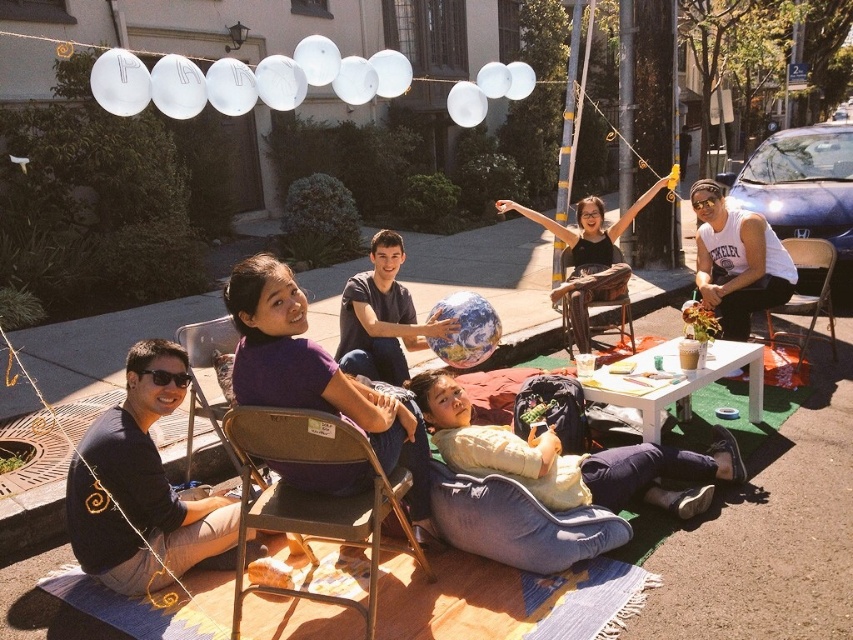
Is black matte shirt at lower left thinner than brown fabric chair at center?

No.

Which of these two, black matte shirt at lower left or brown fabric chair at center, stands shorter?

Standing shorter between the two is brown fabric chair at center.

Find the location of a particular element. This screenshot has height=640, width=853. black matte shirt at lower left is located at coordinates (143, 486).

Consider the image. Can you confirm if light yellow fabric at center is taller than white cotton tank top at upper right?

Incorrect, light yellow fabric at center's height is not larger of white cotton tank top at upper right's.

Does point (608, 451) come farther from viewer compared to point (695, 234)?

No, (608, 451) is closer to viewer.

The height and width of the screenshot is (640, 853). I want to click on light yellow fabric at center, so click(570, 458).

Can you confirm if black matte shirt at lower left is thinner than metallic silver folding chair at right?

Indeed, black matte shirt at lower left has a lesser width compared to metallic silver folding chair at right.

The width and height of the screenshot is (853, 640). What do you see at coordinates (143, 486) in the screenshot?
I see `black matte shirt at lower left` at bounding box center [143, 486].

Where is `black matte shirt at lower left`? This screenshot has width=853, height=640. black matte shirt at lower left is located at coordinates (143, 486).